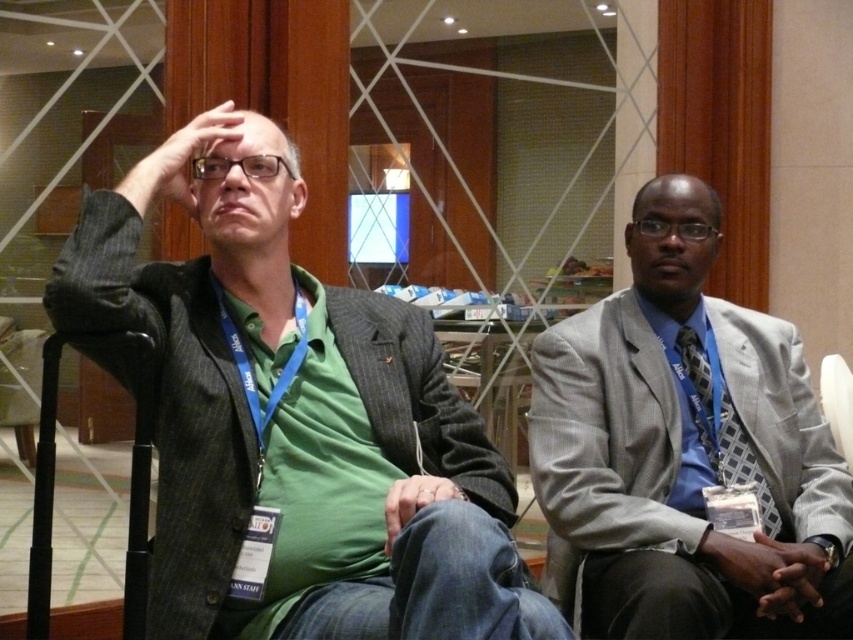
Question: Is green fabric shirt at left smaller than gray textured suit at right?

Choices:
 (A) yes
 (B) no

Answer: (B)

Question: Can you confirm if gray textured suit at right is positioned to the right of blue checkered tie at right?

Choices:
 (A) yes
 (B) no

Answer: (B)

Question: Based on their relative distances, which object is nearer to the gray textured suit at right?

Choices:
 (A) green fabric shirt at left
 (B) blue checkered tie at right

Answer: (B)

Question: Does green fabric shirt at left have a greater width compared to gray textured suit at right?

Choices:
 (A) yes
 (B) no

Answer: (A)

Question: Considering the real-world distances, which object is closest to the blue checkered tie at right?

Choices:
 (A) green fabric shirt at left
 (B) gray textured suit at right

Answer: (B)

Question: Which point appears closest to the camera in this image?

Choices:
 (A) (276, 317)
 (B) (740, 444)

Answer: (A)